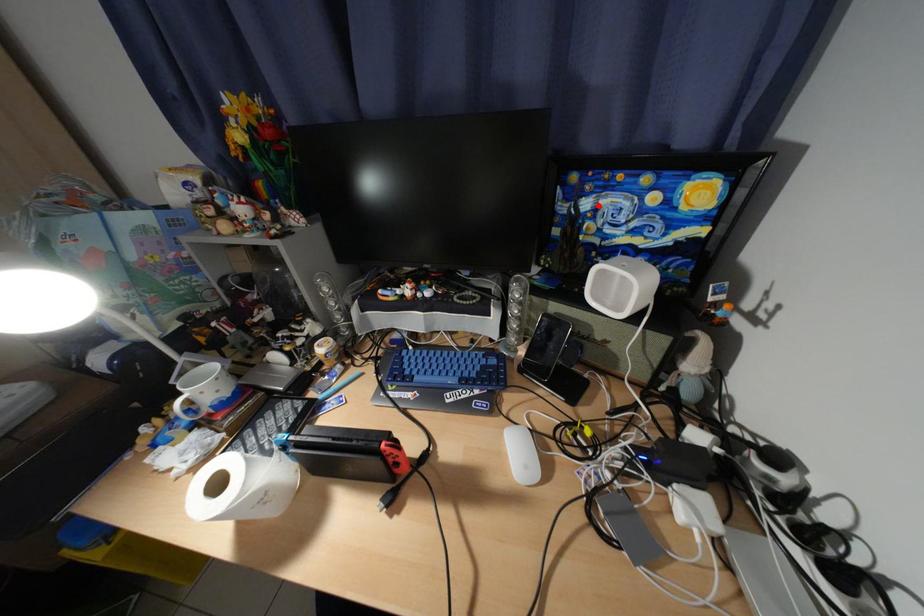
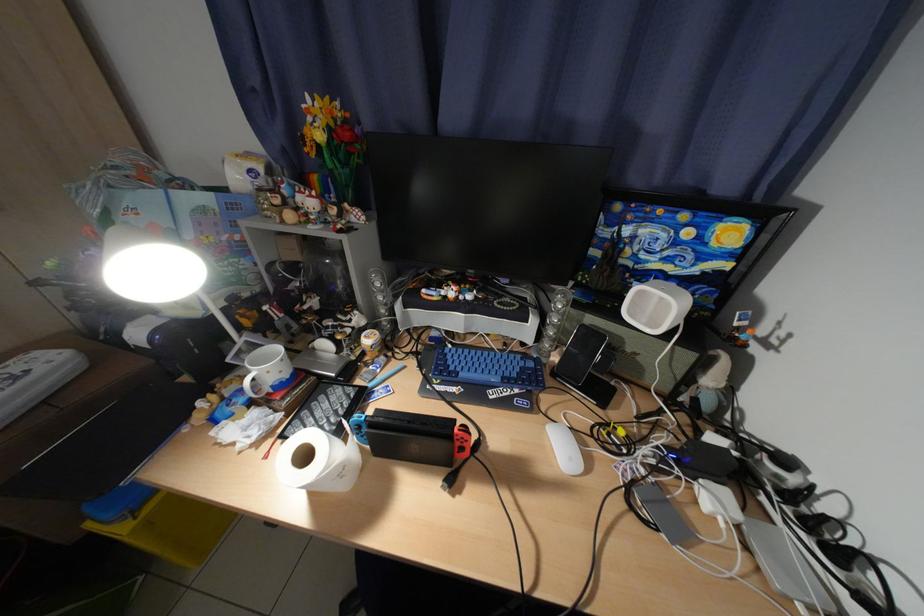
Where in the second image is the point corresponding to the highlighted location from the first image?

(638, 233)